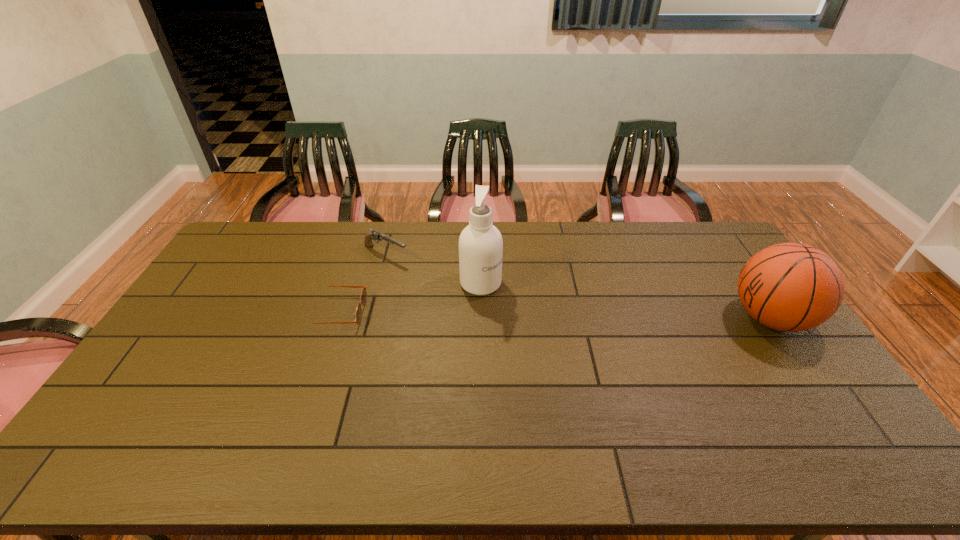
Identify the location of vacant space located 0.110m on the front label of the tallest object. (518, 310).

Identify the location of vacant position located on the front label of the tallest object. The height and width of the screenshot is (540, 960). click(x=538, y=324).

Identify the location of vacant area located aiming along the barrel of the third tallest object. The height and width of the screenshot is (540, 960). (440, 279).

I want to click on free point located 0.300m aiming along the barrel of the third tallest object, so click(x=469, y=293).

Identify the location of vacant position located 0.090m aiming along the barrel of the third tallest object. (x=422, y=270).

Where is `object that is positioned at the far edge`? This screenshot has width=960, height=540. object that is positioned at the far edge is located at coordinates (375, 235).

What are the coordinates of `object located in the right edge section of the desktop` in the screenshot? It's located at (791, 287).

This screenshot has height=540, width=960. Find the location of `vacant space at the far edge of the desktop`. vacant space at the far edge of the desktop is located at coordinates (461, 225).

Where is `vacant area at the near edge`? The image size is (960, 540). vacant area at the near edge is located at coordinates (268, 407).

Where is `vacant region at the left edge of the desktop`? The image size is (960, 540). vacant region at the left edge of the desktop is located at coordinates (146, 365).